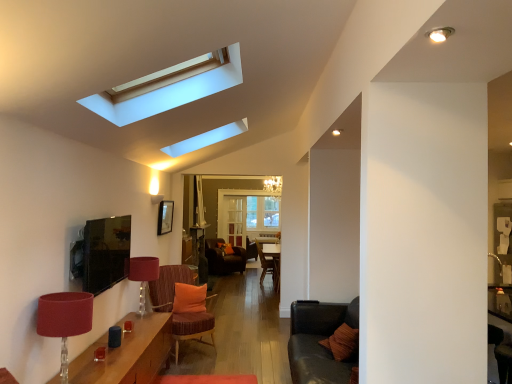
Question: From a real-world perspective, is matte red lampshade at lower left, which ranks as the 1th lamp in back-to-front order, physically below velvet orange armchair at center?

Choices:
 (A) yes
 (B) no

Answer: (B)

Question: Would you say matte red lampshade at lower left, arranged as the second lamp when viewed from the front, contains velvet orange armchair at center?

Choices:
 (A) yes
 (B) no

Answer: (B)

Question: Can you confirm if matte red lampshade at lower left, arranged as the second lamp when viewed from the front, is positioned to the left of velvet orange armchair at center?

Choices:
 (A) no
 (B) yes

Answer: (B)

Question: From a real-world perspective, is matte red lampshade at lower left, arranged as the second lamp when viewed from the front, located higher than velvet orange armchair at center?

Choices:
 (A) no
 (B) yes

Answer: (B)

Question: Does matte red lampshade at lower left, which ranks as the 1th lamp in back-to-front order, have a lesser height compared to velvet orange armchair at center?

Choices:
 (A) no
 (B) yes

Answer: (B)

Question: From the image's perspective, is matte red lampshade at lower left, arranged as the second lamp when viewed from the front, located beneath velvet orange armchair at center?

Choices:
 (A) no
 (B) yes

Answer: (A)

Question: Considering the relative sizes of matte red lampshade at lower left, which appears as the 2th lamp when viewed from the back, and matte red lampshade at lower left, arranged as the second lamp when viewed from the front, in the image provided, is matte red lampshade at lower left, which appears as the 2th lamp when viewed from the back, taller than matte red lampshade at lower left, arranged as the second lamp when viewed from the front,?

Choices:
 (A) no
 (B) yes

Answer: (B)

Question: Could you tell me if matte red lampshade at lower left, which appears as the 2th lamp when viewed from the back, is facing matte red lampshade at lower left, arranged as the second lamp when viewed from the front?

Choices:
 (A) yes
 (B) no

Answer: (B)

Question: Considering the relative sizes of matte red lampshade at lower left, acting as the 1th lamp starting from the front, and matte red lampshade at lower left, which ranks as the 1th lamp in back-to-front order, in the image provided, is matte red lampshade at lower left, acting as the 1th lamp starting from the front, thinner than matte red lampshade at lower left, which ranks as the 1th lamp in back-to-front order,?

Choices:
 (A) no
 (B) yes

Answer: (A)

Question: Can you confirm if matte red lampshade at lower left, which appears as the 2th lamp when viewed from the back, is bigger than matte red lampshade at lower left, which ranks as the 1th lamp in back-to-front order?

Choices:
 (A) no
 (B) yes

Answer: (B)

Question: From a real-world perspective, is matte red lampshade at lower left, which appears as the 2th lamp when viewed from the back, located higher than matte red lampshade at lower left, which ranks as the 1th lamp in back-to-front order?

Choices:
 (A) no
 (B) yes

Answer: (A)

Question: Are matte red lampshade at lower left, acting as the 1th lamp starting from the front, and matte red lampshade at lower left, which ranks as the 1th lamp in back-to-front order, far apart?

Choices:
 (A) yes
 (B) no

Answer: (A)

Question: Would you consider velvet orange armchair at center to be distant from matte red lampshade at lower left, which ranks as the 1th lamp in back-to-front order?

Choices:
 (A) no
 (B) yes

Answer: (B)